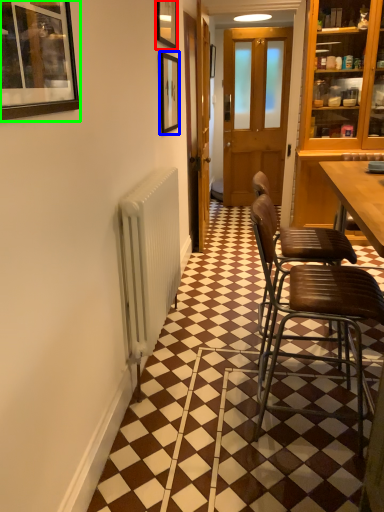
Question: Which object is positioned closest to picture frame (highlighted by a red box)? Select from picture frame (highlighted by a blue box) and picture frame (highlighted by a green box).

Choices:
 (A) picture frame
 (B) picture frame

Answer: (A)